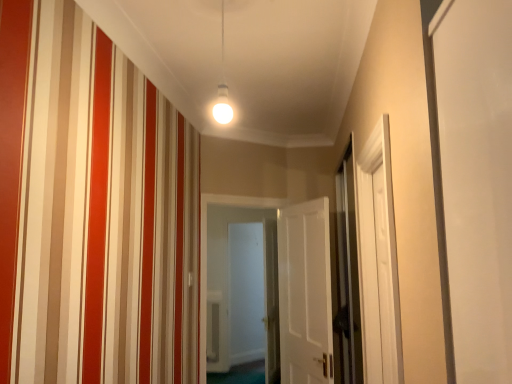
Question: Should I look upward or downward to see white matte door at center, marked as the 1th door in a right-to-left arrangement?

Choices:
 (A) down
 (B) up

Answer: (A)

Question: Can you confirm if white wooden door at center, the 2th door in the right-to-left sequence, is taller than white glossy door at center, the 2th screen door viewed from the right?

Choices:
 (A) yes
 (B) no

Answer: (B)

Question: Is the position of white wooden door at center, the 2th door in the right-to-left sequence, less distant than that of white glossy door at center, which is the 1th screen door from back to front?

Choices:
 (A) no
 (B) yes

Answer: (B)

Question: Is white wooden door at center, the 2th door in the right-to-left sequence, not within white glossy door at center, which appears as the second screen door when viewed from the front?

Choices:
 (A) yes
 (B) no

Answer: (A)

Question: Considering the relative sizes of white wooden door at center, the 2th door in the right-to-left sequence, and white glossy door at center, the 2th screen door viewed from the right, in the image provided, is white wooden door at center, the 2th door in the right-to-left sequence, bigger than white glossy door at center, the 2th screen door viewed from the right,?

Choices:
 (A) yes
 (B) no

Answer: (A)

Question: From the image's perspective, is white wooden door at center, the 2th door in the right-to-left sequence, beneath white glossy door at center, acting as the first screen door starting from the left?

Choices:
 (A) no
 (B) yes

Answer: (A)

Question: Considering the relative sizes of white wooden door at center, which ranks as the first door in left-to-right order, and white glossy door at center, which is the 1th screen door from back to front, in the image provided, is white wooden door at center, which ranks as the first door in left-to-right order, thinner than white glossy door at center, which is the 1th screen door from back to front,?

Choices:
 (A) no
 (B) yes

Answer: (A)

Question: Is white glossy door at center, which is the 1th screen door from back to front, looking in the opposite direction of clear glass screen door at right, which is the first screen door from right to left?

Choices:
 (A) no
 (B) yes

Answer: (A)

Question: Does white glossy door at center, the 2th screen door viewed from the right, have a greater width compared to clear glass screen door at right, the second screen door from the left?

Choices:
 (A) yes
 (B) no

Answer: (A)

Question: Could you tell me if white glossy door at center, which is the 1th screen door from back to front, is facing clear glass screen door at right, the second screen door from the left?

Choices:
 (A) no
 (B) yes

Answer: (A)

Question: Is white glossy door at center, acting as the first screen door starting from the left, shorter than clear glass screen door at right, which is the first screen door from right to left?

Choices:
 (A) no
 (B) yes

Answer: (A)

Question: Are white glossy door at center, which appears as the second screen door when viewed from the front, and clear glass screen door at right, which is the first screen door from right to left, beside each other?

Choices:
 (A) yes
 (B) no

Answer: (B)

Question: Is clear glass screen door at right, the second screen door viewed from the back, inside white glossy door at center, the 2th screen door viewed from the right?

Choices:
 (A) yes
 (B) no

Answer: (B)

Question: Is white matte door at center, marked as the 1th door in a right-to-left arrangement, at the back of white glossy door at center, which appears as the second screen door when viewed from the front?

Choices:
 (A) no
 (B) yes

Answer: (A)